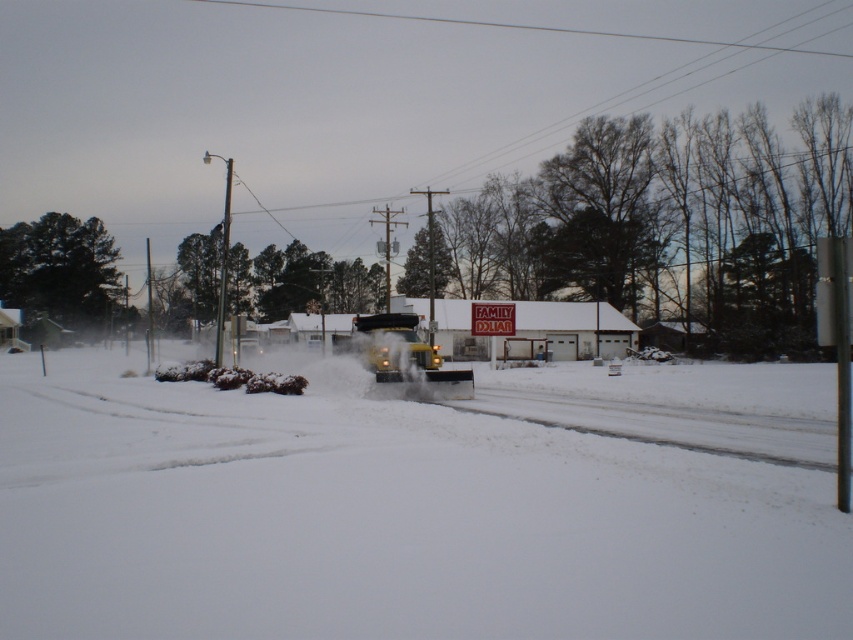
Does point (410, 620) come behind point (389, 323)?

That is False.

Between point (276, 499) and point (352, 336), which one is positioned behind?

The point (352, 336) is more distant.

Where is `white powdery snow at center`? white powdery snow at center is located at coordinates (383, 518).